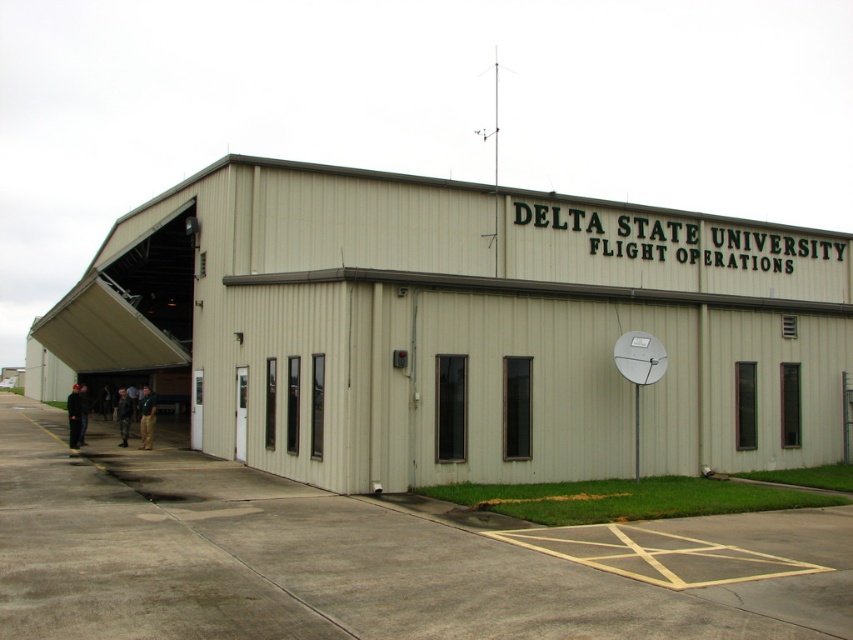
Question: Does beige corrugated metal hangar at center appear over white metallic satellite dish at upper right?

Choices:
 (A) no
 (B) yes

Answer: (B)

Question: Does beige corrugated metal hangar at center appear under white metallic satellite dish at upper right?

Choices:
 (A) yes
 (B) no

Answer: (B)

Question: Which point is closer to the camera taking this photo?

Choices:
 (A) (242, 186)
 (B) (665, 353)

Answer: (B)

Question: Does beige corrugated metal hangar at center have a lesser width compared to white metallic satellite dish at upper right?

Choices:
 (A) yes
 (B) no

Answer: (B)

Question: Which object appears closest to the camera in this image?

Choices:
 (A) white metallic satellite dish at upper right
 (B) beige corrugated metal hangar at center

Answer: (B)

Question: Which object is closer to the camera taking this photo?

Choices:
 (A) beige corrugated metal hangar at center
 (B) white metallic satellite dish at upper right

Answer: (A)